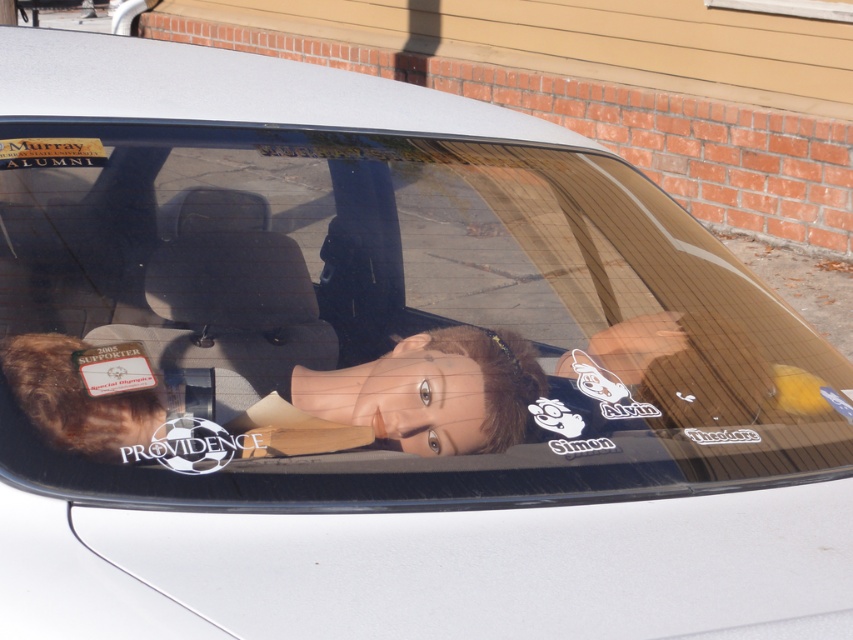
Question: Is brown plush toy at center in front of matte paper sticker at lower left?

Choices:
 (A) yes
 (B) no

Answer: (A)

Question: Does brown plush toy at center appear on the left side of matte paper sticker at lower left?

Choices:
 (A) no
 (B) yes

Answer: (A)

Question: Which point is closer to the camera?

Choices:
 (A) (471, 428)
 (B) (91, 394)

Answer: (B)

Question: Which of the following is the farthest from the observer?

Choices:
 (A) (389, 364)
 (B) (141, 388)

Answer: (A)

Question: Which of the following is the farthest from the observer?

Choices:
 (A) matte paper sticker at lower left
 (B) brown plush toy at center

Answer: (A)

Question: Where is brown plush toy at center located in relation to matte paper sticker at lower left in the image?

Choices:
 (A) above
 (B) below

Answer: (B)